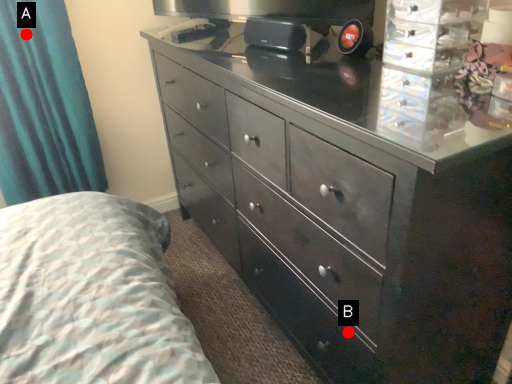
Question: Two points are circled on the image, labeled by A and B beside each circle. Which point appears farthest from the camera in this image?

Choices:
 (A) A is further
 (B) B is further

Answer: (A)